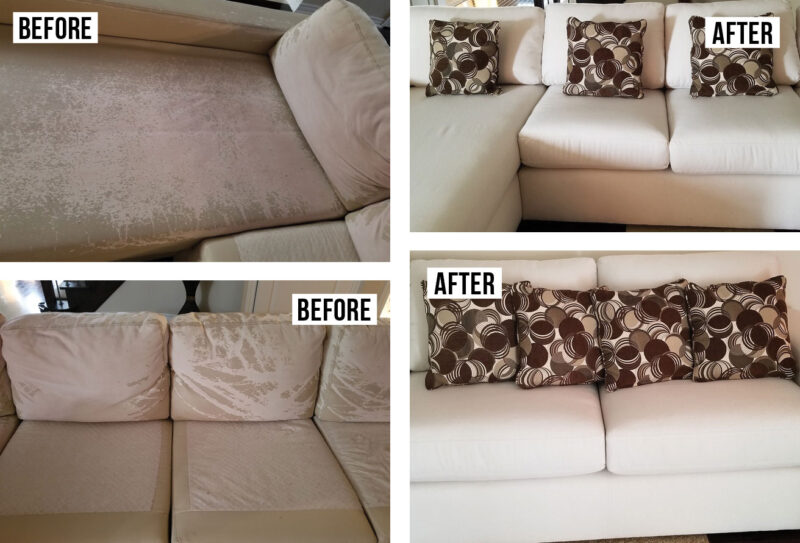
Locate an element on the screen. Image resolution: width=800 pixels, height=543 pixels. light brown couch is located at coordinates (462, 540), (154, 236), (141, 454).